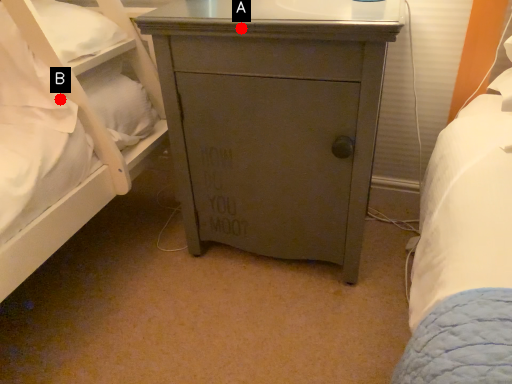
Question: Two points are circled on the image, labeled by A and B beside each circle. Which of the following is the closest to the observer?

Choices:
 (A) A is closer
 (B) B is closer

Answer: (A)